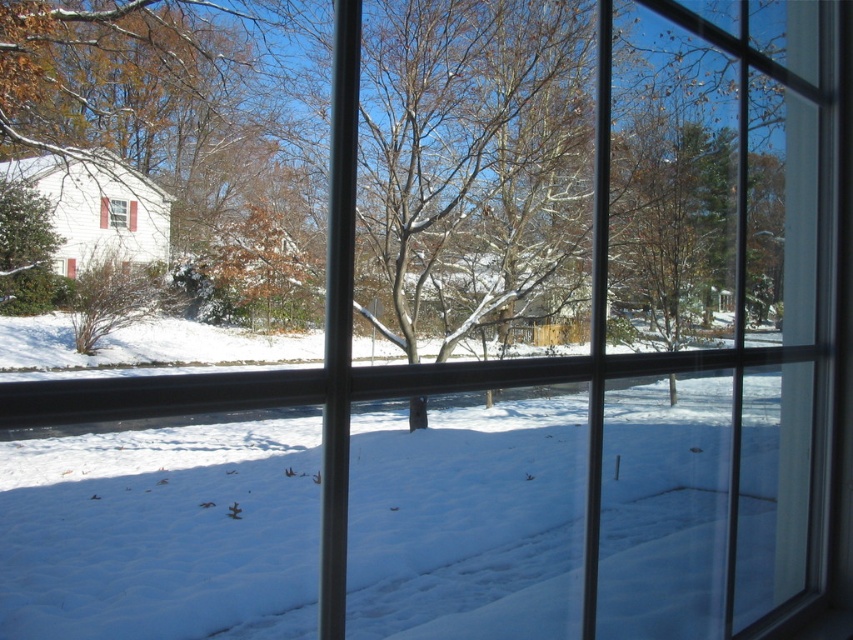
Who is higher up, matte white window at upper left or clear glass window at center?

clear glass window at center

Is matte white window at upper left above clear glass window at center?

No.

Does point (132, 202) come behind point (120, 214)?

No, it is not.

This screenshot has height=640, width=853. Find the location of `matte white window at upper left`. matte white window at upper left is located at coordinates (117, 212).